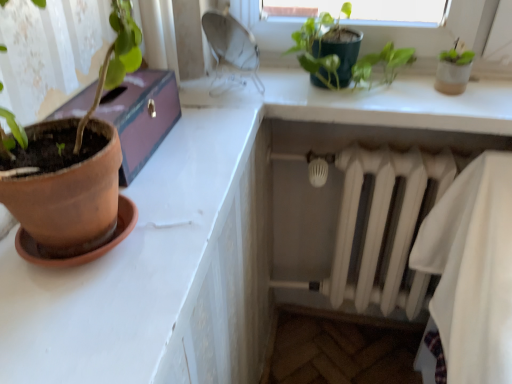
Question: Do you think green matte plant at upper center is within terracotta clay pot at left, or outside of it?

Choices:
 (A) inside
 (B) outside

Answer: (B)

Question: In the image, is green matte plant at upper center positioned in front of or behind terracotta clay pot at left?

Choices:
 (A) front
 (B) behind

Answer: (B)

Question: Which object is the farthest from the white matte radiator at lower right?

Choices:
 (A) terracotta clay pot at left
 (B) terracotta clay pot at left
 (C) green matte plant at upper center

Answer: (A)

Question: Which of these objects is positioned closest to the green matte plant at upper center?

Choices:
 (A) white matte radiator at lower right
 (B) terracotta clay pot at left
 (C) terracotta clay pot at left

Answer: (A)